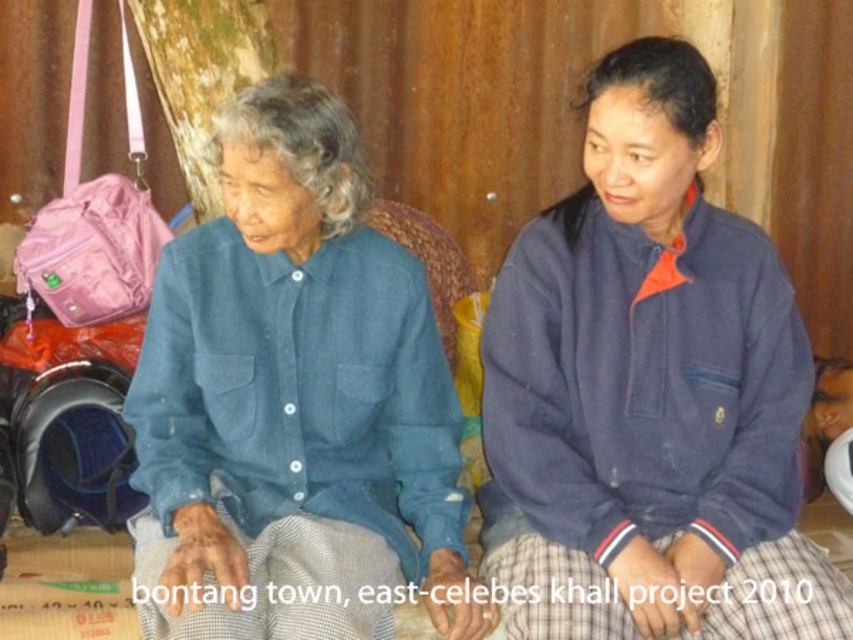
You are a delivery robot with a package that is 18 inches long. You need to place it between the navy blue fleece at center and the blue denim shirt at center. Is there enough space between them to fit the package?

The distance between the navy blue fleece at center and the blue denim shirt at center is 16.58 inches. Since the package is 18 inches long, it is longer than the available space. Therefore, the package cannot fit between them.

You are standing in the scene and want to move from the point at coordinates point (747, 600) to the point at coordinates point (173, 252). Which direction should you move to reach your destination?

To move from point (747, 600) to point (173, 252), you should move backward since point (747, 600) is in front of point (173, 252).

You are a delivery person who needs to place a small package between the navy blue fleece at center and the camera. The package requires at least 1.5 meters of space to ensure safe delivery. Is there enough space between them?

The navy blue fleece at center and camera are 1.62 meters apart from each other, which is more than the required 1.5 meters, so there is enough space to safely place the package between them.